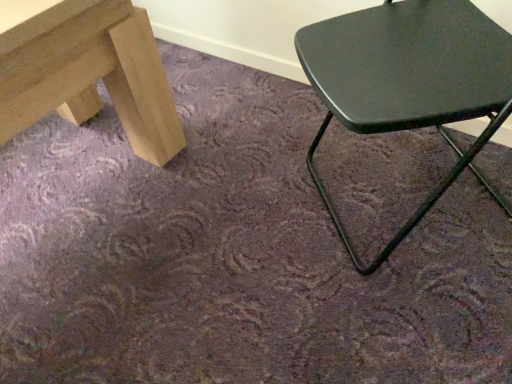
Find the location of `free point to the left of metallic green chair at right`. free point to the left of metallic green chair at right is located at coordinates (236, 251).